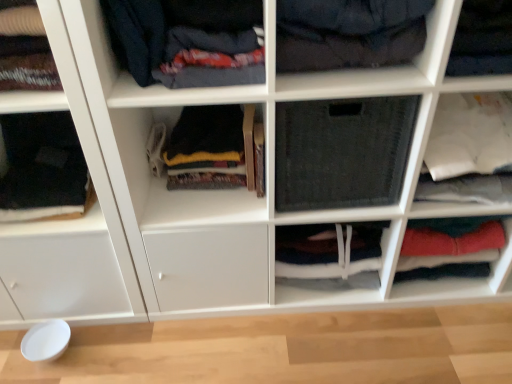
Question: Is the position of black fabric at center, the first clothing viewed from the right, less distant than that of black fabric at left, the fourth clothing positioned from the right?

Choices:
 (A) no
 (B) yes

Answer: (B)

Question: Is black fabric at center, the first clothing viewed from the right, at the left side of black fabric at left, marked as the first clothing in a left-to-right arrangement?

Choices:
 (A) yes
 (B) no

Answer: (B)

Question: Is black fabric at center, the first clothing viewed from the right, positioned beyond the bounds of black fabric at left, the fourth clothing positioned from the right?

Choices:
 (A) no
 (B) yes

Answer: (B)

Question: From a real-world perspective, is black fabric at center, placed as the 4th clothing when sorted from left to right, over black fabric at left, marked as the first clothing in a left-to-right arrangement?

Choices:
 (A) yes
 (B) no

Answer: (A)

Question: Does black fabric at center, placed as the 4th clothing when sorted from left to right, have a greater width compared to black fabric at left, the fourth clothing positioned from the right?

Choices:
 (A) yes
 (B) no

Answer: (B)

Question: Considering the relative positions of black fabric at center, placed as the 4th clothing when sorted from left to right, and black fabric at left, the fourth clothing positioned from the right, in the image provided, is black fabric at center, placed as the 4th clothing when sorted from left to right, to the right of black fabric at left, the fourth clothing positioned from the right, from the viewer's perspective?

Choices:
 (A) no
 (B) yes

Answer: (B)

Question: Does black fabric at center, the first clothing viewed from the right, come behind dark blue fabric at upper left, acting as the 3th clothing starting from the left?

Choices:
 (A) yes
 (B) no

Answer: (A)

Question: Is black fabric at center, the first clothing viewed from the right, taller than dark blue fabric at upper left, arranged as the second clothing when viewed from the right?

Choices:
 (A) no
 (B) yes

Answer: (B)

Question: Can you confirm if black fabric at center, placed as the 4th clothing when sorted from left to right, is shorter than dark blue fabric at upper left, arranged as the second clothing when viewed from the right?

Choices:
 (A) yes
 (B) no

Answer: (B)

Question: Is black fabric at center, placed as the 4th clothing when sorted from left to right, aimed at dark blue fabric at upper left, acting as the 3th clothing starting from the left?

Choices:
 (A) no
 (B) yes

Answer: (A)

Question: Is black fabric at center, the first clothing viewed from the right, wider than dark blue fabric at upper left, acting as the 3th clothing starting from the left?

Choices:
 (A) yes
 (B) no

Answer: (B)

Question: Is black fabric at center, placed as the 4th clothing when sorted from left to right, placed right next to dark blue fabric at upper left, arranged as the second clothing when viewed from the right?

Choices:
 (A) yes
 (B) no

Answer: (B)

Question: Is black fabric at left, the fourth clothing positioned from the right, wider than dark blue fabric at upper center, placed as the third shelf when sorted from right to left?

Choices:
 (A) yes
 (B) no

Answer: (A)